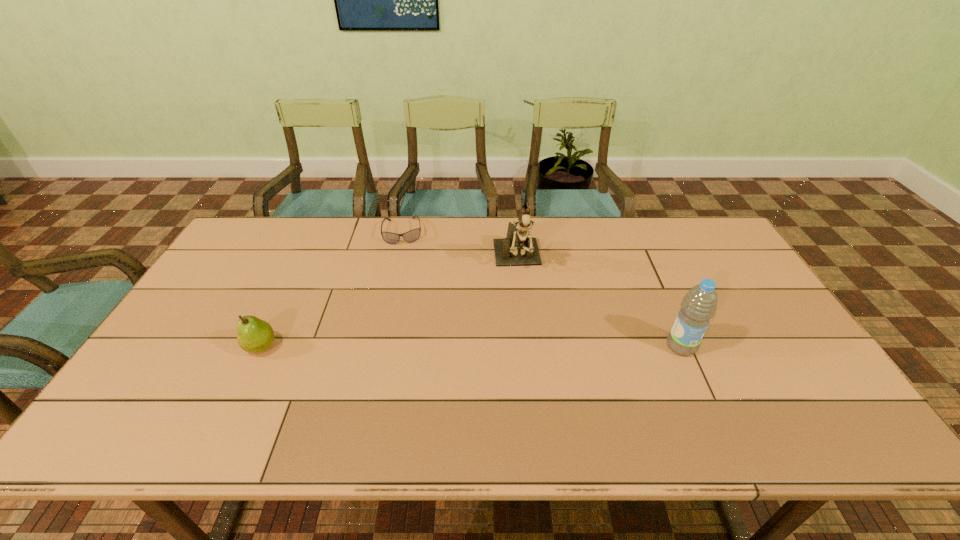
Identify the location of unoccupied position between the leftmost object and the sunglasses. (332, 289).

At what (x,y) coordinates should I click in order to perform the action: click on free space between the water bottle and the second object from right to left. Please return your answer as a coordinate pair (x, y). This screenshot has height=540, width=960. Looking at the image, I should click on (599, 303).

I want to click on unoccupied position between the figurine and the water bottle, so click(599, 303).

Find the location of a particular element. Image resolution: width=960 pixels, height=540 pixels. vacant space that is in between the leftmost object and the sunglasses is located at coordinates (332, 289).

The image size is (960, 540). I want to click on empty space that is in between the water bottle and the figurine, so click(599, 303).

Find the location of `object that is the third closest to the second tallest object`. object that is the third closest to the second tallest object is located at coordinates (254, 335).

The image size is (960, 540). What are the coordinates of `the third closest object relative to the pear` in the screenshot? It's located at (699, 305).

Where is `free space that satisfies the following two spatial constraints: 1. on the back side of the pear; 2. on the right side of the tallest object`? free space that satisfies the following two spatial constraints: 1. on the back side of the pear; 2. on the right side of the tallest object is located at coordinates (302, 261).

You are a GUI agent. You are given a task and a screenshot of the screen. Output one action in this format:
    pyautogui.click(x=<x>, y=<y>)
    Task: Click on the free space that satisfies the following two spatial constraints: 1. on the back side of the leftmost object; 2. on the left side of the shortest object
    The width and height of the screenshot is (960, 540).
    Given the screenshot: What is the action you would take?
    click(x=317, y=232)

What are the coordinates of `vacant region that satisfies the following two spatial constraints: 1. on the front side of the water bottle; 2. on the right side of the third object from left to right` in the screenshot? It's located at (526, 347).